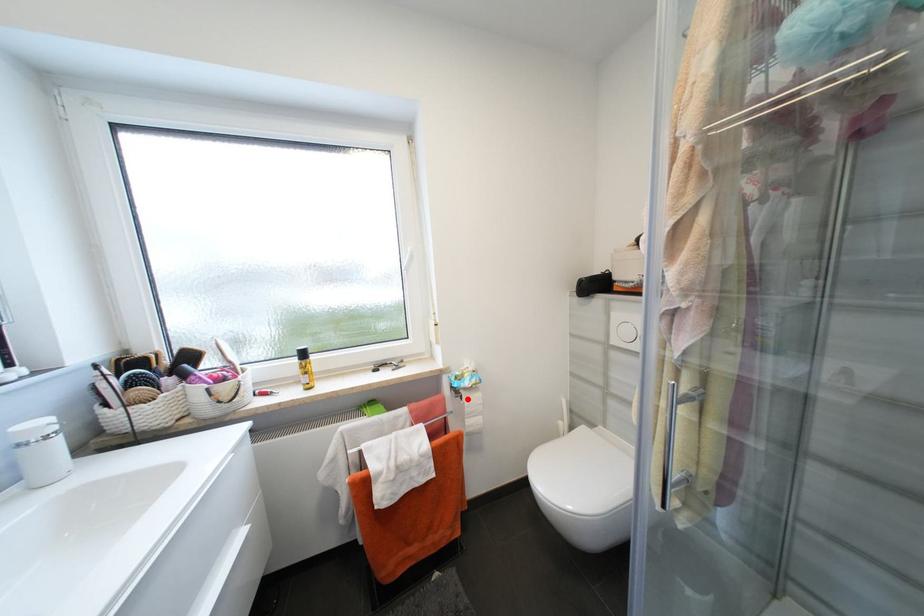
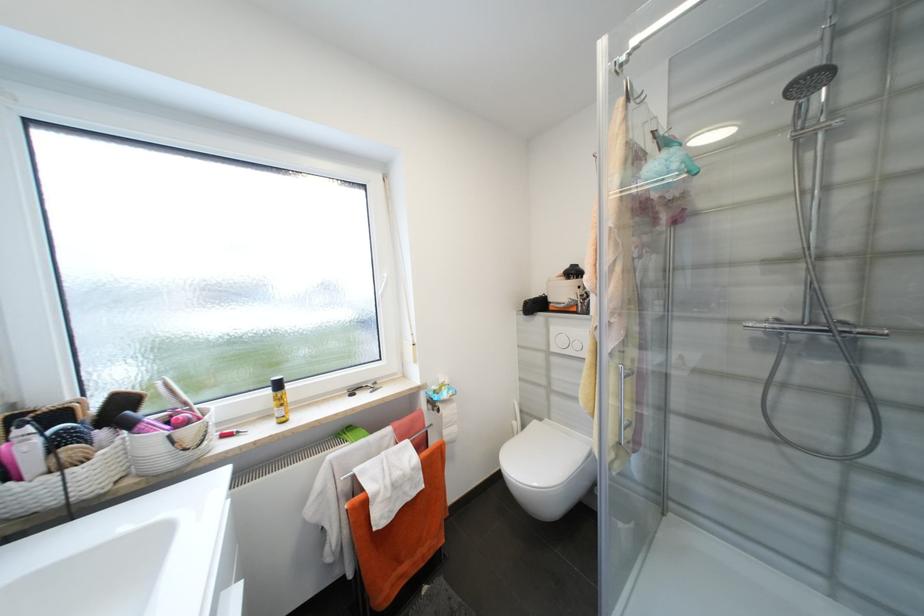
Where in the second image is the point corresponding to the highlighted location from the first image?

(444, 411)